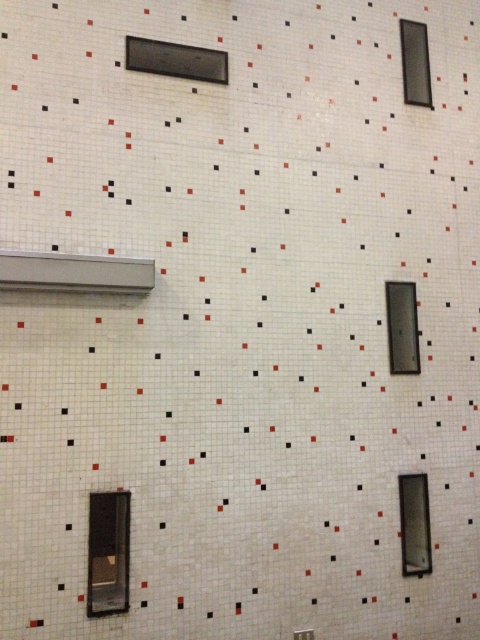
You are standing in front of the tiled wall and want to locate the matte glass window at lower center. According to the coordinates provided, where exactly should you look on the wall?

The matte glass window at lower center is located at the coordinates point (108, 552) on the wall.

You are standing in front of the tiled wall and notice two points marked on it. The first point is at coordinates point (x=407, y=497) and the second is at point (x=427, y=102). Which of these points appears closer to you?

Point (x=407, y=497) is closer to the viewer than point (x=427, y=102).

In the scene shown: You are standing in front of the tiled wall and notice a specific point marked at coordinates (176, 60). What object is located at this point on the wall?

The point at coordinates (176, 60) corresponds to the matte black window at upper center.